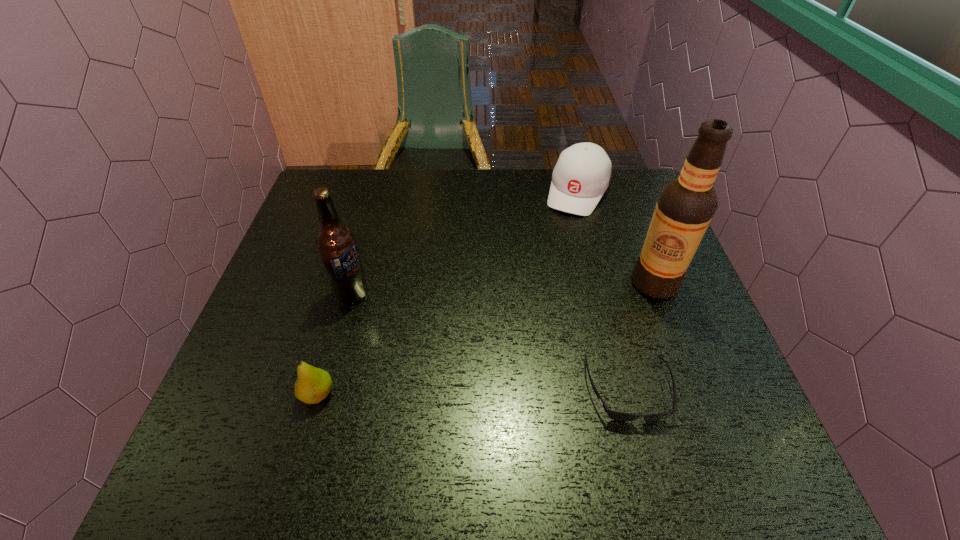
Where is `vacant region located 0.220m on the label of the alcohol`? The image size is (960, 540). vacant region located 0.220m on the label of the alcohol is located at coordinates (568, 332).

The height and width of the screenshot is (540, 960). Find the location of `vacant space positioned 0.320m on the label of the alcohol`. vacant space positioned 0.320m on the label of the alcohol is located at coordinates (533, 352).

Where is `vacant area located 0.210m on the label of the beer bottle`? vacant area located 0.210m on the label of the beer bottle is located at coordinates (425, 349).

Where is `vacant region located on the label of the beer bottle`? This screenshot has width=960, height=540. vacant region located on the label of the beer bottle is located at coordinates (493, 400).

Locate an element on the screen. The image size is (960, 540). vacant space located on the label of the beer bottle is located at coordinates (442, 361).

Where is `object that is positioned at the far edge`? This screenshot has height=540, width=960. object that is positioned at the far edge is located at coordinates (582, 174).

The width and height of the screenshot is (960, 540). Find the location of `pear situated at the near edge`. pear situated at the near edge is located at coordinates (313, 384).

The width and height of the screenshot is (960, 540). I want to click on sunglasses that is at the near edge, so click(x=614, y=415).

Locate an element on the screen. This screenshot has width=960, height=540. object located in the left edge section of the desktop is located at coordinates (313, 384).

The image size is (960, 540). Identify the location of sunglasses located at the right edge. (614, 415).